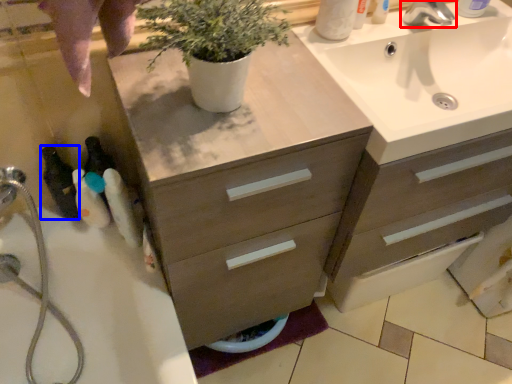
Question: Among these objects, which one is nearest to the camera, tap (highlighted by a red box) or toiletry (highlighted by a blue box)?

Choices:
 (A) tap
 (B) toiletry

Answer: (B)